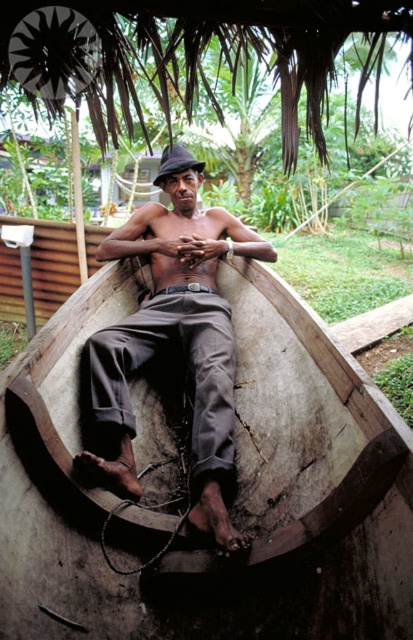
Is wooden canoe at center closer to the viewer compared to matte brown pants at center?

Yes, it is in front of matte brown pants at center.

Between point (303, 301) and point (158, 304), which one is positioned behind?

Positioned behind is point (158, 304).

I want to click on wooden canoe at center, so click(x=237, y=483).